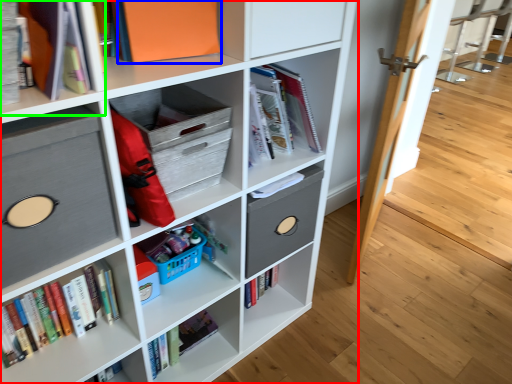
Question: Based on their relative distances, which object is nearer to shelf (highlighted by a red box)? Choose from paperback book (highlighted by a blue box) and shelf (highlighted by a green box).

Choices:
 (A) paperback book
 (B) shelf

Answer: (A)